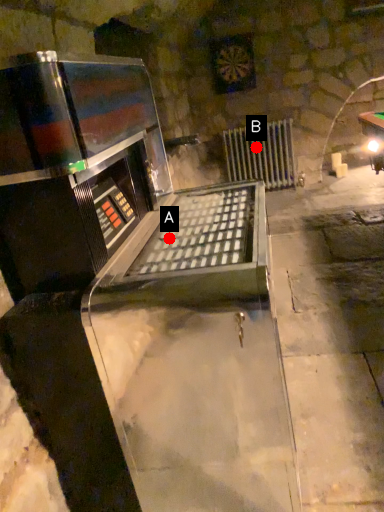
Question: Two points are circled on the image, labeled by A and B beside each circle. Which point is farther to the camera?

Choices:
 (A) A is further
 (B) B is further

Answer: (B)